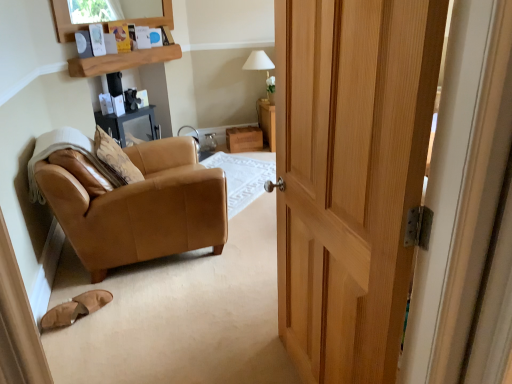
The height and width of the screenshot is (384, 512). I want to click on vacant space behind tan suede slippers at lower left, so click(104, 283).